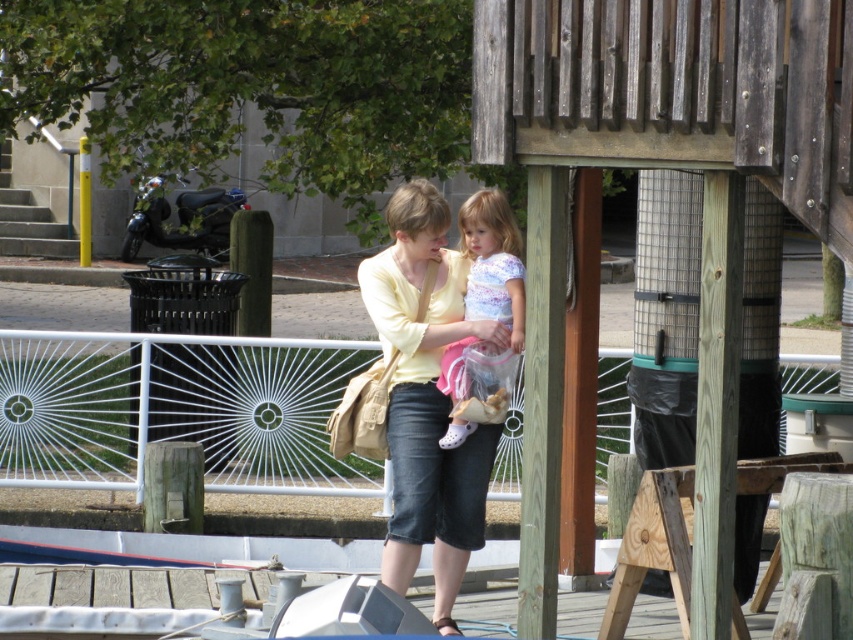
You are standing at the point marked by the coordinates point (427,397). What object is directly in front of you?

The point (427,397) marks the matte yellow sweater at center, so the object directly in front of you is the matte yellow sweater at center.